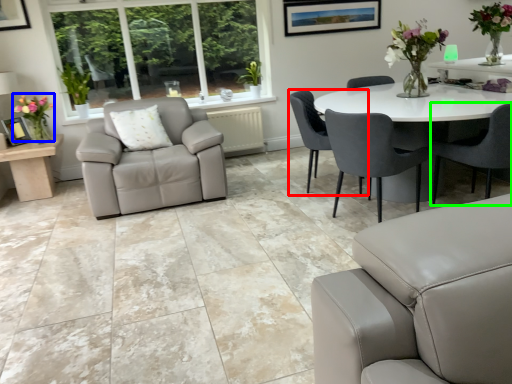
Question: Which object is positioned farthest from chair (highlighted by a red box)? Select from floral arrangement (highlighted by a blue box) and chair (highlighted by a green box).

Choices:
 (A) floral arrangement
 (B) chair

Answer: (A)